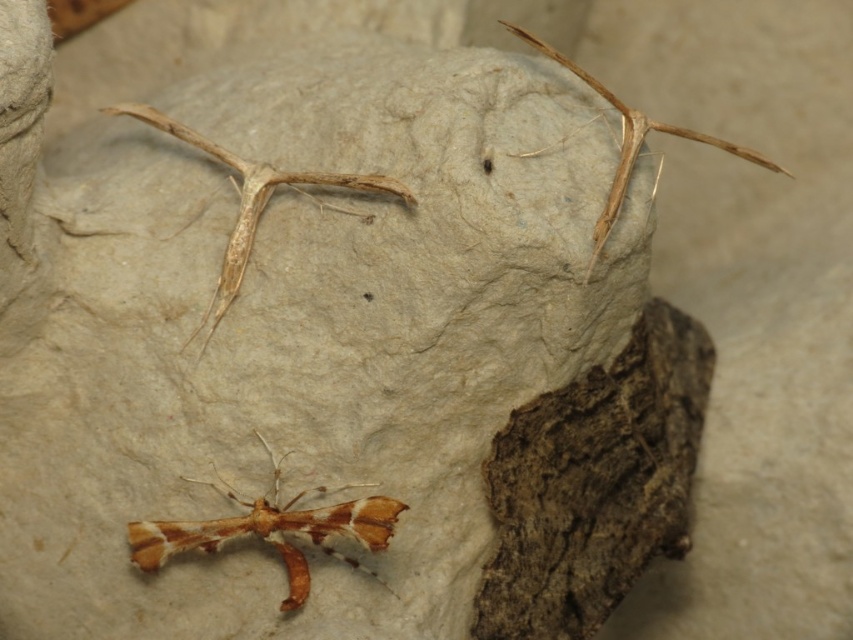
Question: Based on their relative distances, which object is farther from the translucent beige moth at upper center?

Choices:
 (A) brown matte insect at upper right
 (B) brown papery moth at lower left

Answer: (A)

Question: Can you confirm if brown papery moth at lower left is wider than brown matte insect at upper right?

Choices:
 (A) no
 (B) yes

Answer: (A)

Question: Which point is farther to the camera?

Choices:
 (A) (252, 225)
 (B) (312, 534)

Answer: (A)

Question: Which of the following is the closest to the observer?

Choices:
 (A) brown matte insect at upper right
 (B) brown papery moth at lower left

Answer: (A)

Question: In this image, where is brown papery moth at lower left located relative to brown matte insect at upper right?

Choices:
 (A) left
 (B) right

Answer: (A)

Question: In this image, where is brown papery moth at lower left located relative to brown matte insect at upper right?

Choices:
 (A) above
 (B) below

Answer: (B)